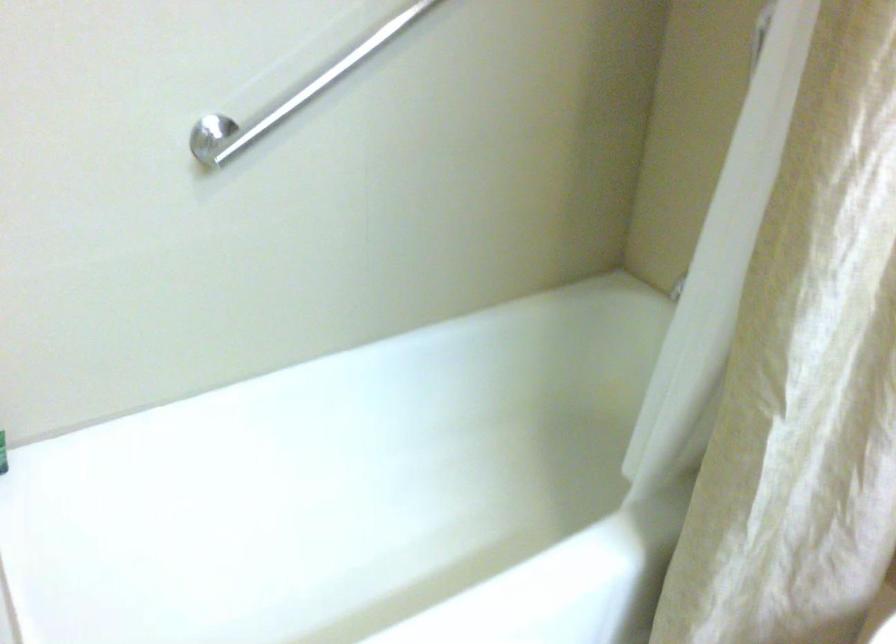
The height and width of the screenshot is (644, 896). Describe the element at coordinates (291, 96) in the screenshot. I see `the metal grab bar` at that location.